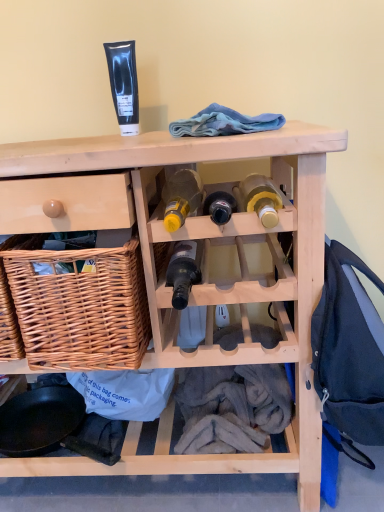
Question: Is translucent glass wine bottle at center, which ranks as the 2th bottle in right-to-left order, bigger than dark blue backpack at right, placed as the first clothing when sorted from bottom to top?

Choices:
 (A) yes
 (B) no

Answer: (B)

Question: Is the depth of translucent glass wine bottle at center, the second bottle in the left-to-right sequence, greater than that of dark blue backpack at right, arranged as the 2th clothing when viewed from the top?

Choices:
 (A) no
 (B) yes

Answer: (B)

Question: From the image's perspective, would you say translucent glass wine bottle at center, the second bottle in the left-to-right sequence, is positioned over dark blue backpack at right, placed as the first clothing when sorted from bottom to top?

Choices:
 (A) no
 (B) yes

Answer: (B)

Question: From a real-world perspective, is translucent glass wine bottle at center, the second bottle in the left-to-right sequence, on top of dark blue backpack at right, arranged as the 2th clothing when viewed from the top?

Choices:
 (A) yes
 (B) no

Answer: (A)

Question: Considering the relative sizes of translucent glass wine bottle at center, the second bottle in the left-to-right sequence, and dark blue backpack at right, which is the 2th clothing from left to right, in the image provided, is translucent glass wine bottle at center, the second bottle in the left-to-right sequence, taller than dark blue backpack at right, which is the 2th clothing from left to right,?

Choices:
 (A) yes
 (B) no

Answer: (B)

Question: Which is correct: woven brown basket at left is inside blue fleece at upper center, placed as the 2th clothing when sorted from bottom to top, or outside of it?

Choices:
 (A) inside
 (B) outside

Answer: (B)

Question: From a real-world perspective, is woven brown basket at left physically located above or below blue fleece at upper center, acting as the first clothing starting from the left?

Choices:
 (A) below
 (B) above

Answer: (A)

Question: Does point (117, 329) appear closer or farther from the camera than point (220, 129)?

Choices:
 (A) closer
 (B) farther

Answer: (B)

Question: Considering their positions, is woven brown basket at left located in front of or behind blue fleece at upper center, placed as the 2th clothing when sorted from bottom to top?

Choices:
 (A) front
 (B) behind

Answer: (A)

Question: Looking at the image, does translucent glass wine bottle at center, the second bottle in the left-to-right sequence, seem bigger or smaller compared to yellow glass bottle at center, the first bottle when ordered from left to right?

Choices:
 (A) big
 (B) small

Answer: (B)

Question: Considering the positions of translucent glass wine bottle at center, the second bottle in the left-to-right sequence, and yellow glass bottle at center, the first bottle when ordered from left to right, in the image, is translucent glass wine bottle at center, the second bottle in the left-to-right sequence, wider or thinner than yellow glass bottle at center, the first bottle when ordered from left to right,?

Choices:
 (A) wide
 (B) thin

Answer: (B)

Question: Does point (170, 266) appear closer or farther from the camera than point (173, 174)?

Choices:
 (A) farther
 (B) closer

Answer: (B)

Question: From the image's perspective, is translucent glass wine bottle at center, which ranks as the 2th bottle in right-to-left order, positioned above or below yellow glass bottle at center, the first bottle when ordered from left to right?

Choices:
 (A) below
 (B) above

Answer: (A)

Question: From a real-world perspective, is blue fleece at upper center, placed as the 2th clothing when sorted from bottom to top, physically located above or below yellow glass bottle at center, the third bottle viewed from the right?

Choices:
 (A) above
 (B) below

Answer: (A)

Question: From their relative heights in the image, would you say blue fleece at upper center, placed as the 2th clothing when sorted from bottom to top, is taller or shorter than yellow glass bottle at center, the third bottle viewed from the right?

Choices:
 (A) short
 (B) tall

Answer: (A)